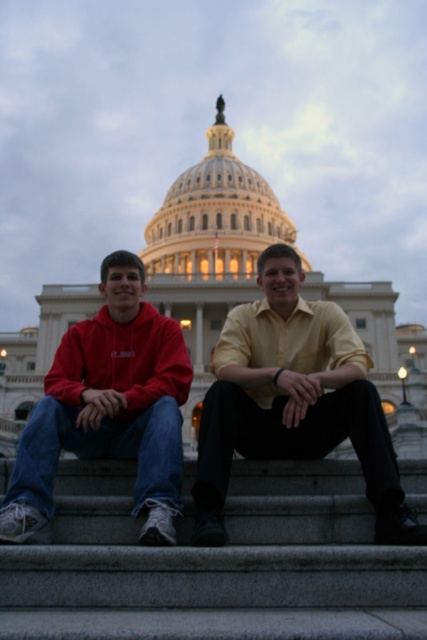
Is yellow satin shirt at center positioned behind matte red hoodie at center?

No, yellow satin shirt at center is in front of matte red hoodie at center.

Is yellow satin shirt at center below matte red hoodie at center?

Correct, yellow satin shirt at center is located below matte red hoodie at center.

Image resolution: width=427 pixels, height=640 pixels. I want to click on yellow satin shirt at center, so click(x=294, y=401).